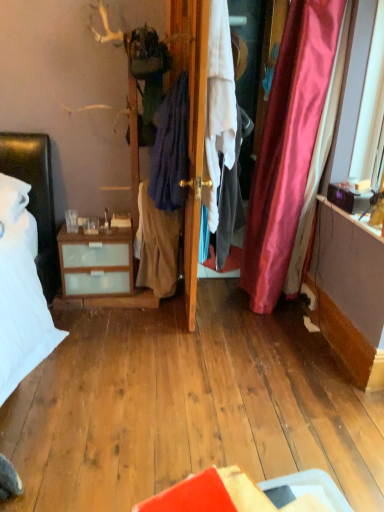
Question: Is wooden door at center not inside white cotton shirt at center, which is the third clothing in left-to-right order?

Choices:
 (A) no
 (B) yes

Answer: (B)

Question: From a real-world perspective, is wooden door at center over white cotton shirt at center, the first clothing when ordered from right to left?

Choices:
 (A) no
 (B) yes

Answer: (B)

Question: Is wooden door at center wider than white cotton shirt at center, which is the third clothing in left-to-right order?

Choices:
 (A) no
 (B) yes

Answer: (B)

Question: Does wooden door at center have a lesser width compared to white cotton shirt at center, which is the third clothing in left-to-right order?

Choices:
 (A) no
 (B) yes

Answer: (A)

Question: Can you confirm if wooden door at center is bigger than white cotton shirt at center, the first clothing when ordered from right to left?

Choices:
 (A) no
 (B) yes

Answer: (A)

Question: From the image's perspective, is wooden door at center below white cotton shirt at center, the first clothing when ordered from right to left?

Choices:
 (A) no
 (B) yes

Answer: (A)

Question: Considering the relative sizes of beige cotton skirt at center, which is the first clothing in left-to-right order, and wooden door at center in the image provided, is beige cotton skirt at center, which is the first clothing in left-to-right order, thinner than wooden door at center?

Choices:
 (A) no
 (B) yes

Answer: (B)

Question: Is beige cotton skirt at center, which is the first clothing in left-to-right order, shorter than wooden door at center?

Choices:
 (A) no
 (B) yes

Answer: (B)

Question: Does beige cotton skirt at center, positioned as the third clothing in right-to-left order, lie behind wooden door at center?

Choices:
 (A) no
 (B) yes

Answer: (B)

Question: Does beige cotton skirt at center, positioned as the third clothing in right-to-left order, have a smaller size compared to wooden door at center?

Choices:
 (A) yes
 (B) no

Answer: (A)

Question: Is beige cotton skirt at center, positioned as the third clothing in right-to-left order, in front of wooden door at center?

Choices:
 (A) no
 (B) yes

Answer: (A)

Question: From a real-world perspective, is beige cotton skirt at center, which is the first clothing in left-to-right order, located higher than wooden door at center?

Choices:
 (A) no
 (B) yes

Answer: (A)

Question: Is wooden door at center placed right next to white fabric screen door at center?

Choices:
 (A) yes
 (B) no

Answer: (A)